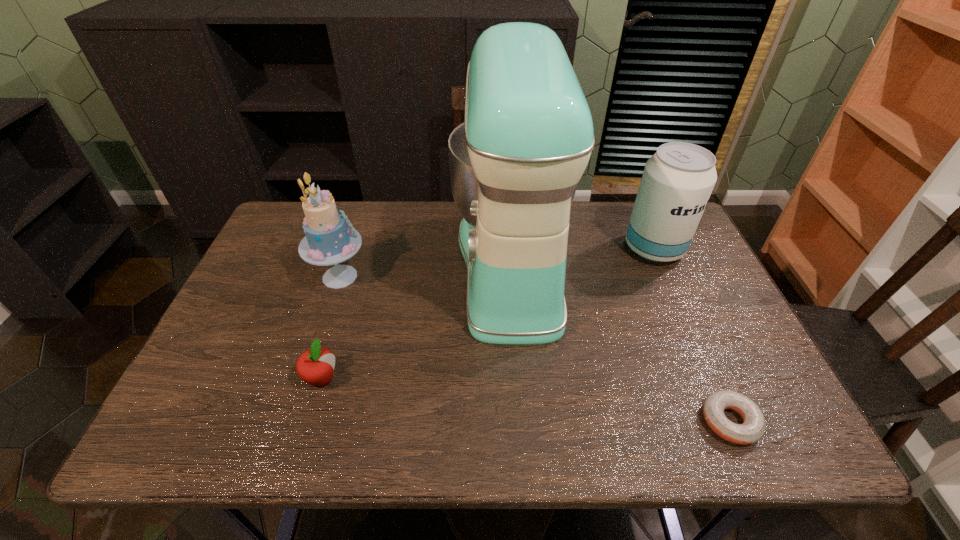
Locate an element on the screen. vacant space in between the tallest object and the second shortest object is located at coordinates (417, 322).

Where is `vacant space that is in between the nearest object and the alcohol`? The width and height of the screenshot is (960, 540). vacant space that is in between the nearest object and the alcohol is located at coordinates (692, 335).

I want to click on vacant region between the third object from right to left and the cake, so click(426, 271).

The width and height of the screenshot is (960, 540). Identify the location of empty space between the mixer and the cake. (426, 271).

I want to click on free space between the cake and the apple, so click(x=331, y=327).

Locate an element on the screen. Image resolution: width=960 pixels, height=540 pixels. the closest object to the alcohol is located at coordinates (527, 137).

Where is `object that stands as the second closest to the shortest object`? Image resolution: width=960 pixels, height=540 pixels. object that stands as the second closest to the shortest object is located at coordinates (677, 181).

At what (x,y) coordinates should I click in order to perform the action: click on free spot that satisfies the following two spatial constraints: 1. on the front side of the shortest object; 2. on the left side of the apple. Please return your answer as a coordinate pair (x, y). This screenshot has height=540, width=960. Looking at the image, I should click on (309, 421).

Find the location of `free location that satisfies the following two spatial constraints: 1. on the back side of the shortest object; 2. at the base of the tallest object`. free location that satisfies the following two spatial constraints: 1. on the back side of the shortest object; 2. at the base of the tallest object is located at coordinates (661, 265).

Where is `vacant space that satisfies the following two spatial constraints: 1. on the front side of the alcohol; 2. with a ladder on the side of the cake`? Image resolution: width=960 pixels, height=540 pixels. vacant space that satisfies the following two spatial constraints: 1. on the front side of the alcohol; 2. with a ladder on the side of the cake is located at coordinates (666, 276).